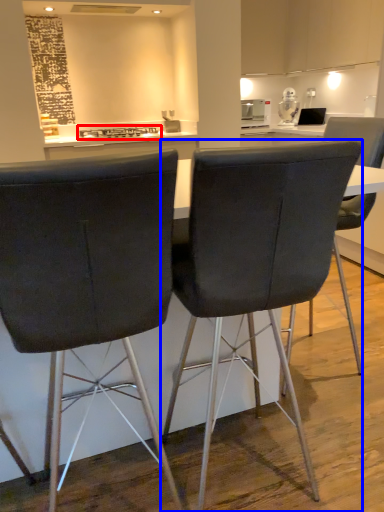
Question: Among these objects, which one is farthest to the camera, stove (highlighted by a red box) or chair (highlighted by a blue box)?

Choices:
 (A) stove
 (B) chair

Answer: (A)